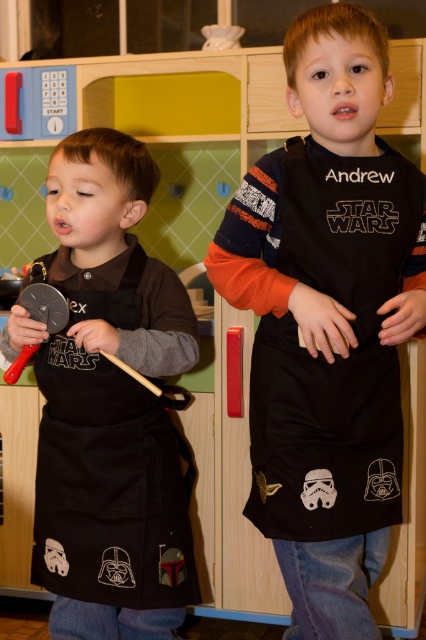
Consider the image. Who is higher up, black fabric apron at center or black matte apron at left?

black fabric apron at center is higher up.

Is black fabric apron at center shorter than black matte apron at left?

In fact, black fabric apron at center may be taller than black matte apron at left.

Identify the location of black fabric apron at center. The image size is (426, 640). (328, 321).

Where is `black fabric apron at center`? black fabric apron at center is located at coordinates (328, 321).